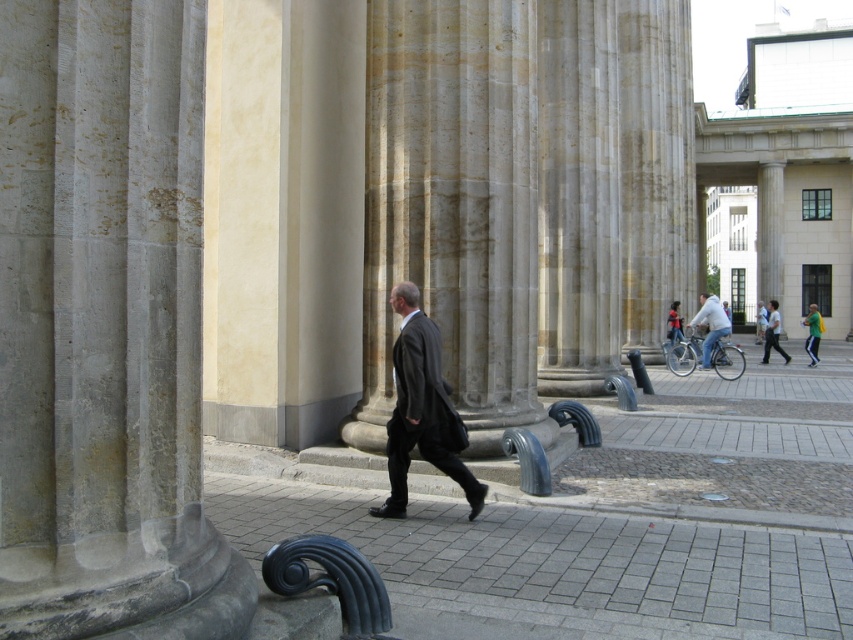
You are a photographer trying to capture a photo of the light blue shirt at center and the gray concrete pavement at center in the same frame. Based on their sizes, which object should you focus on first to ensure both are in focus?

The gray concrete pavement at center is smaller in width than the light blue shirt at center, so you should focus on the light blue shirt at center first to ensure both are in focus.

You are standing in the plaza and see the gray stone column at center and the dark gray suit at center. From your perspective, which object is positioned to the left?

The gray stone column at center is to the left of the dark gray suit at center.